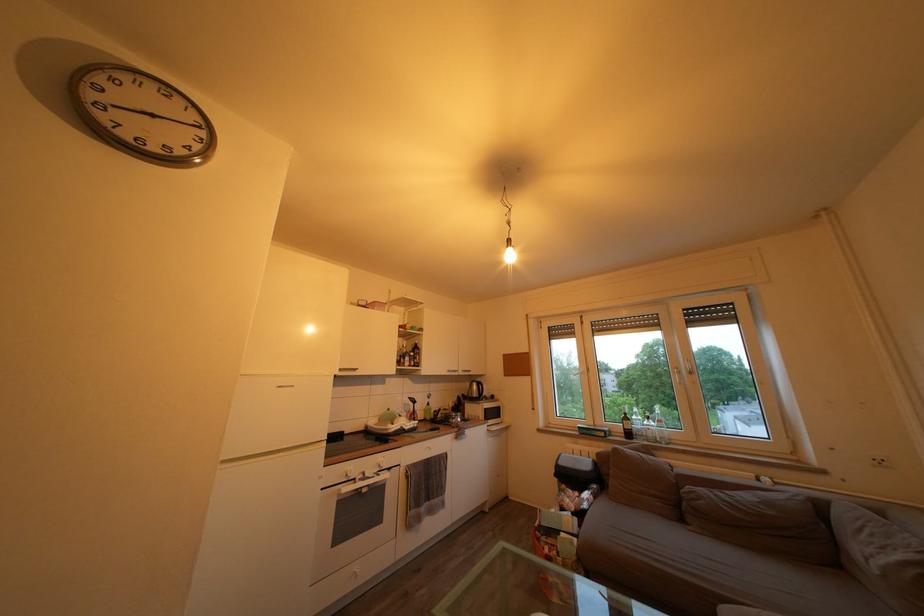
In order to click on sofa sitting surface in this screenshot , I will do `click(752, 520)`.